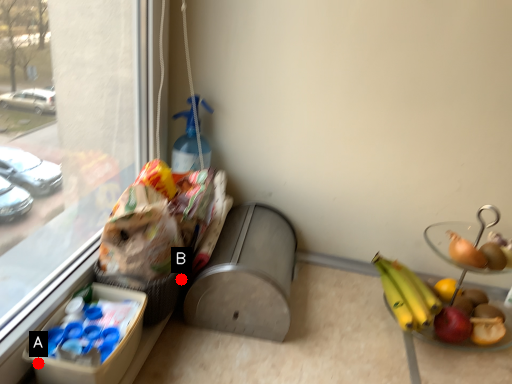
Question: Two points are circled on the image, labeled by A and B beside each circle. Among these points, which one is farthest from the camera?

Choices:
 (A) A is further
 (B) B is further

Answer: (B)